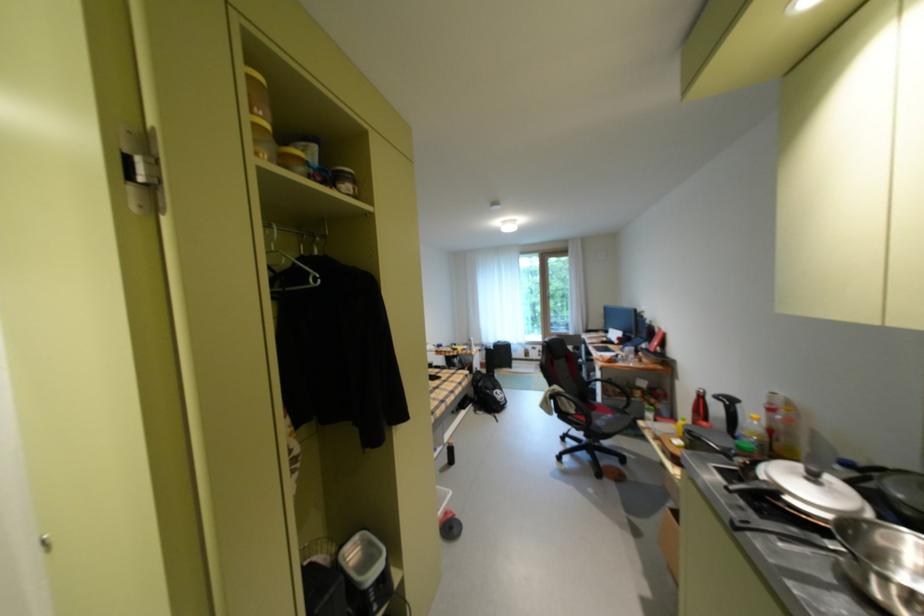
Image resolution: width=924 pixels, height=616 pixels. In order to click on white storage container in this screenshot , I will do coord(361,559).